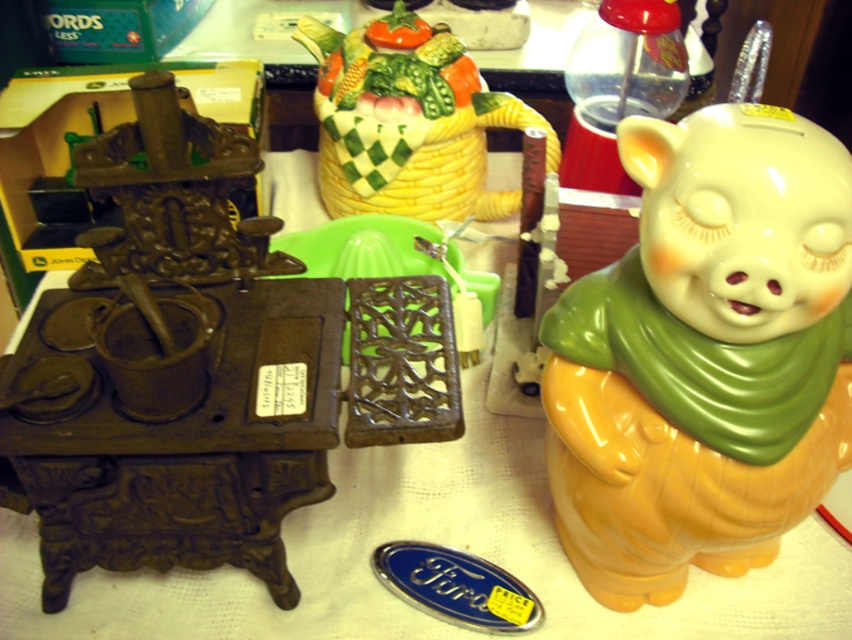
You are a customer at a flea market and see the matte yellow piggy bank at right and the porcelain basket at upper center. Which item is positioned lower on the table?

The matte yellow piggy bank at right is located below the porcelain basket at upper center, so it is positioned lower on the table.

You are a customer at the flea market and want to place a small book between the matte yellow piggy bank at right and the porcelain basket at upper center. Which object should you place the book closer to if you want it to be near the thinner item?

The matte yellow piggy bank at right is thinner than the porcelain basket at upper center, so you should place the book closer to the matte yellow piggy bank at right.